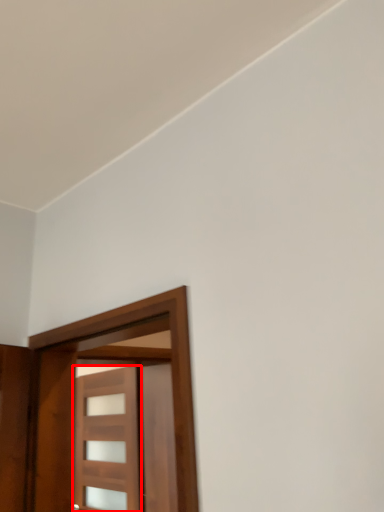
Question: From the image, what is the correct spatial relationship of door (annotated by the red box) in relation to door?

Choices:
 (A) left
 (B) right

Answer: (A)